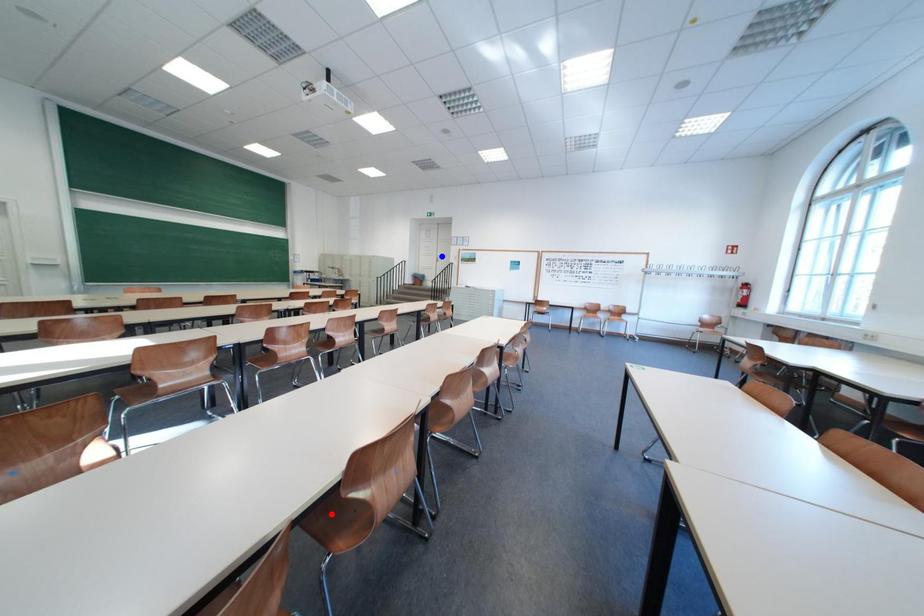
Question: Which of the two points in the image is closer to the camera?

Choices:
 (A) Blue point is closer.
 (B) Red point is closer.

Answer: (B)